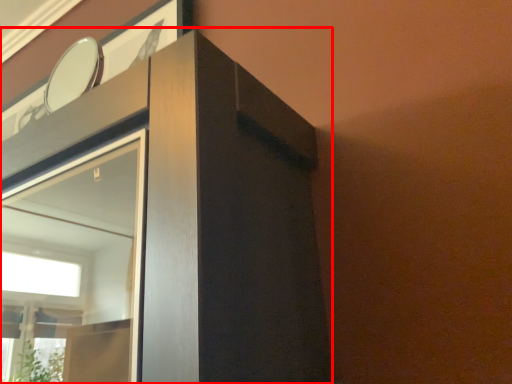
Question: In this image, where is dresser (annotated by the red box) located relative to mirror?

Choices:
 (A) left
 (B) right

Answer: (A)